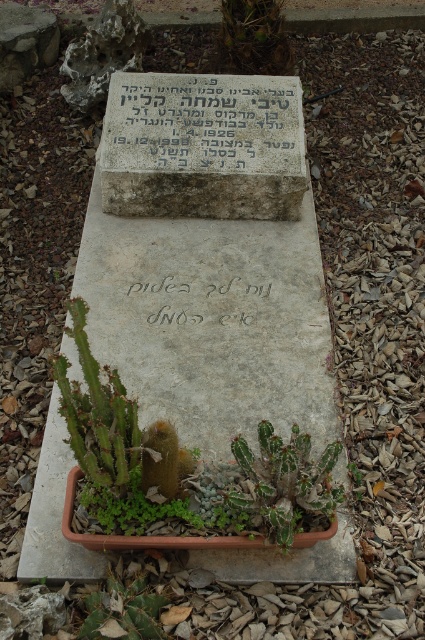
Which is in front, point (297, 108) or point (190, 323)?

Positioned in front is point (190, 323).

Which is above, stone inscription at center or white stone writing at center?

Positioned higher is stone inscription at center.

Image resolution: width=425 pixels, height=640 pixels. I want to click on stone inscription at center, so click(x=203, y=124).

Can you confirm if green spiky cactus at center is thinner than green spiky cactus at upper center?

Yes.

Does green spiky cactus at center lie behind green spiky cactus at upper center?

No, green spiky cactus at center is in front of green spiky cactus at upper center.

Between point (280, 509) and point (246, 29), which one is positioned behind?

The point (246, 29) is behind.

You are a GUI agent. You are given a task and a screenshot of the screen. Output one action in this format:
    pyautogui.click(x=<x>, y=<y>)
    Task: Click on the green spiky cactus at center
    The width and height of the screenshot is (425, 640).
    Given the screenshot: What is the action you would take?
    pyautogui.click(x=285, y=486)

How distant is stone inscription at center from green spiky cactus at center?

They are 3.78 feet apart.

Is point (243, 104) positioned in front of point (251, 525)?

No, (243, 104) is further to viewer.

Between point (138, 145) and point (294, 525), which one is positioned behind?

The point (138, 145) is more distant.

The width and height of the screenshot is (425, 640). What are the coordinates of `stone inscription at center` in the screenshot? It's located at (203, 124).